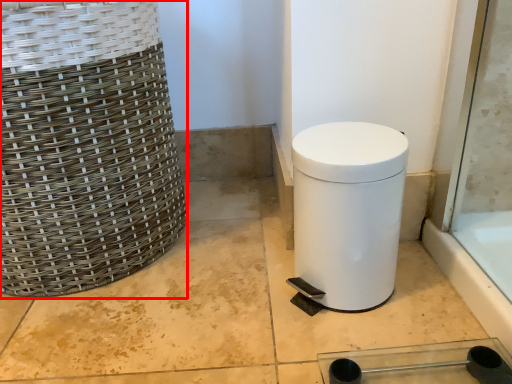
Question: Where is basket (annotated by the red box) located in relation to waste container in the image?

Choices:
 (A) left
 (B) right

Answer: (A)